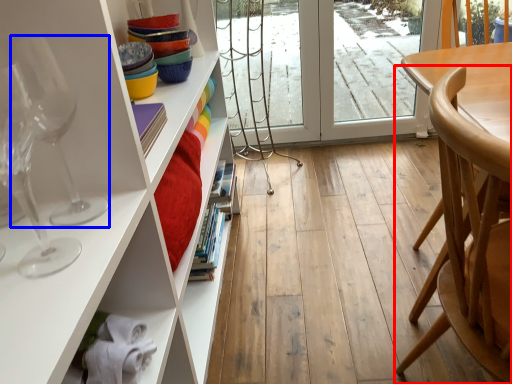
Question: Which point is closer to the camera, chair (highlighted by a red box) or wine glass (highlighted by a blue box)?

Choices:
 (A) chair
 (B) wine glass

Answer: (A)